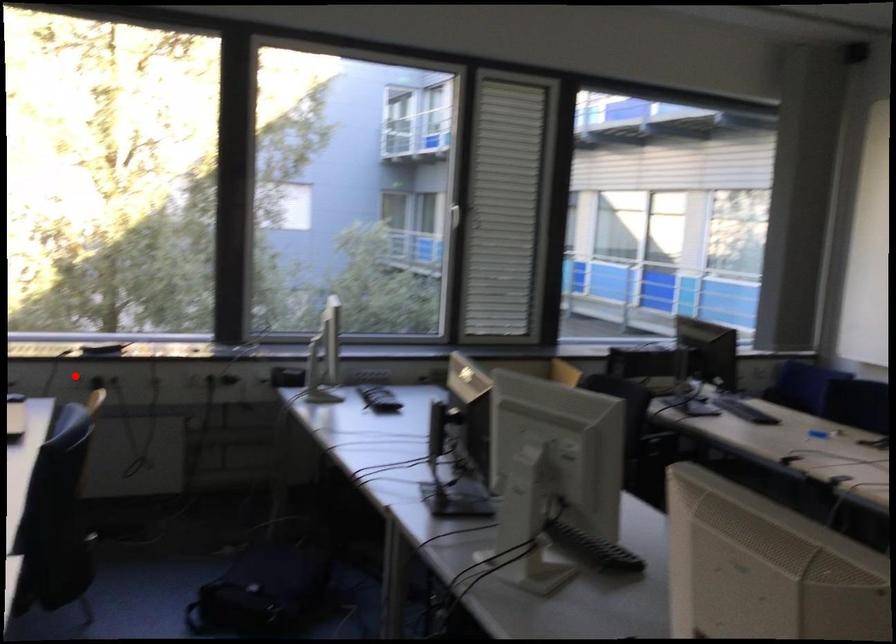
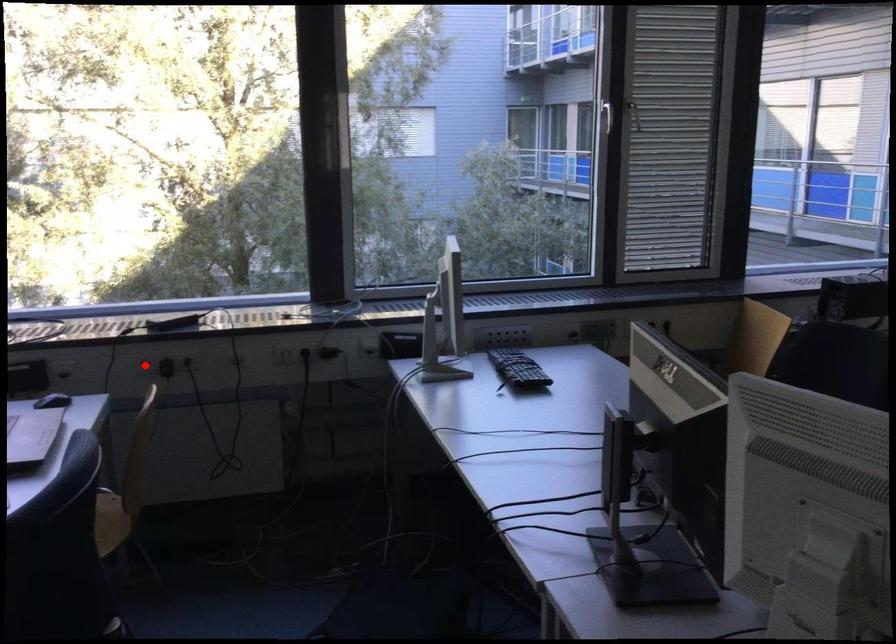
I am providing you with two images of the same scene from different viewpoints. A red point is marked on the first image and another point is marked on the second image. Is the marked point in image1 the same physical position as the marked point in image2?

Yes